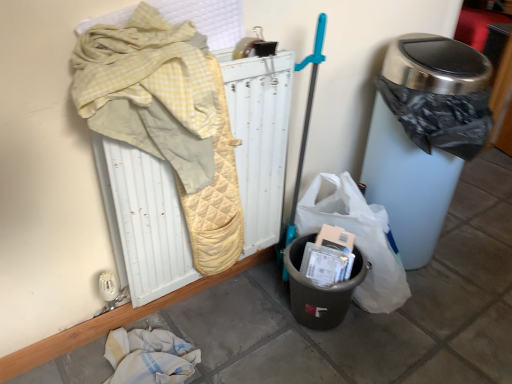
Question: Is point (468, 69) closer or farther from the camera than point (347, 304)?

Choices:
 (A) closer
 (B) farther

Answer: (A)

Question: Considering the relative positions of metallic trash can at right and black plastic recycling bin at lower center in the image provided, is metallic trash can at right to the left or to the right of black plastic recycling bin at lower center?

Choices:
 (A) left
 (B) right

Answer: (B)

Question: Which object is the closest to the metallic trash can at right?

Choices:
 (A) yellow quilted radiator at upper left
 (B) black plastic recycling bin at lower center

Answer: (B)

Question: Which object is the farthest from the metallic trash can at right?

Choices:
 (A) black plastic recycling bin at lower center
 (B) yellow quilted radiator at upper left

Answer: (B)